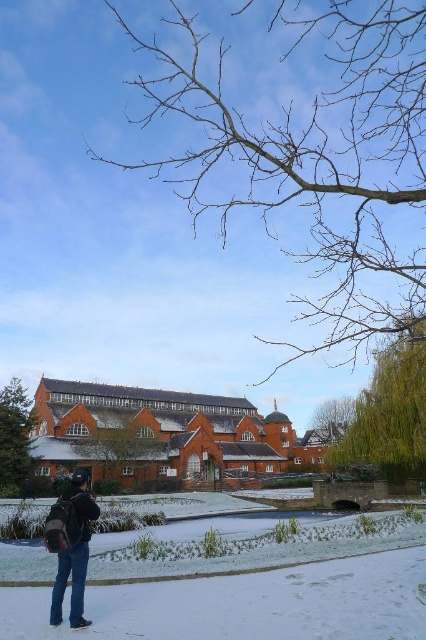
From the picture: You are standing at the camera position and want to walk towards the building. Is the white powdery snow at lower center in your path?

The white powdery snow at lower center is located at point (x=233, y=582) in the image. Since the path leads directly towards the building and the snow is at the lower center, it would be in your path as you walk towards the building.

You are standing at the entrance of the red brick building and see the brown textured tree at center and the matte black backpack at lower left. Which object is closer to the building?

The brown textured tree at center is closer to the building because it is positioned on the left side of the matte black backpack at lower left, which is further away from the building.